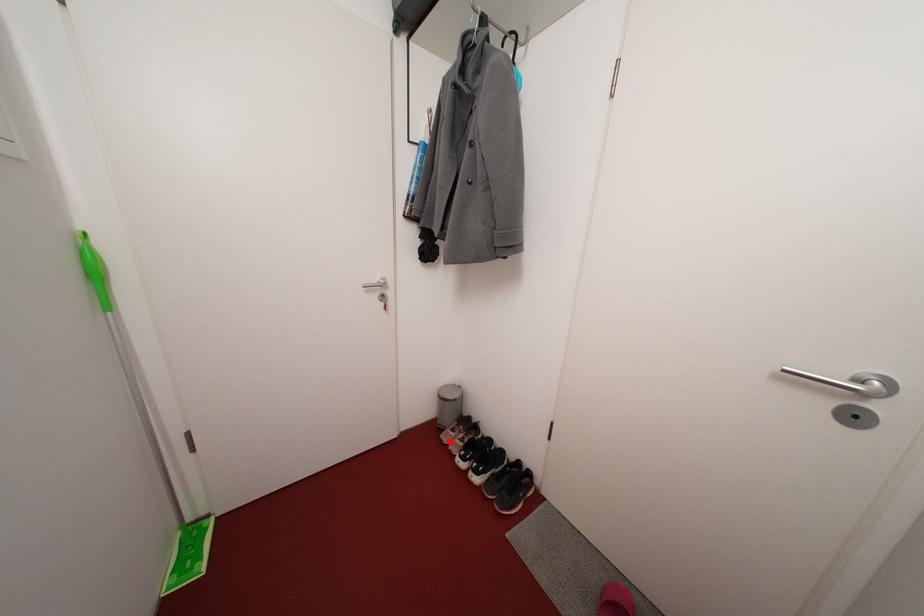
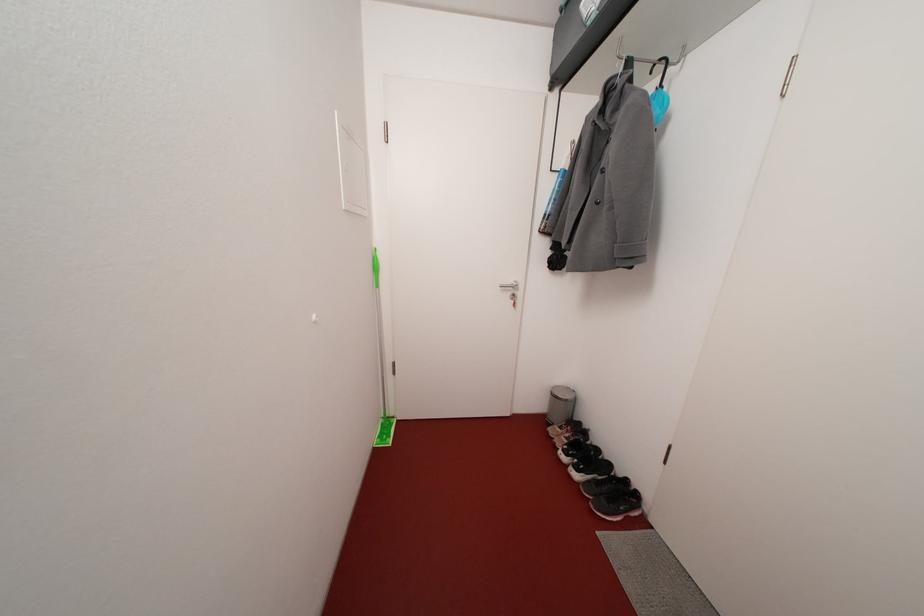
Question: I am providing you with two images of the same scene from different viewpoints. Given a red point in image1, look at the same physical point in image2. Is it:

Choices:
 (A) Closer to the viewpoint
 (B) Farther from the viewpoint

Answer: (B)